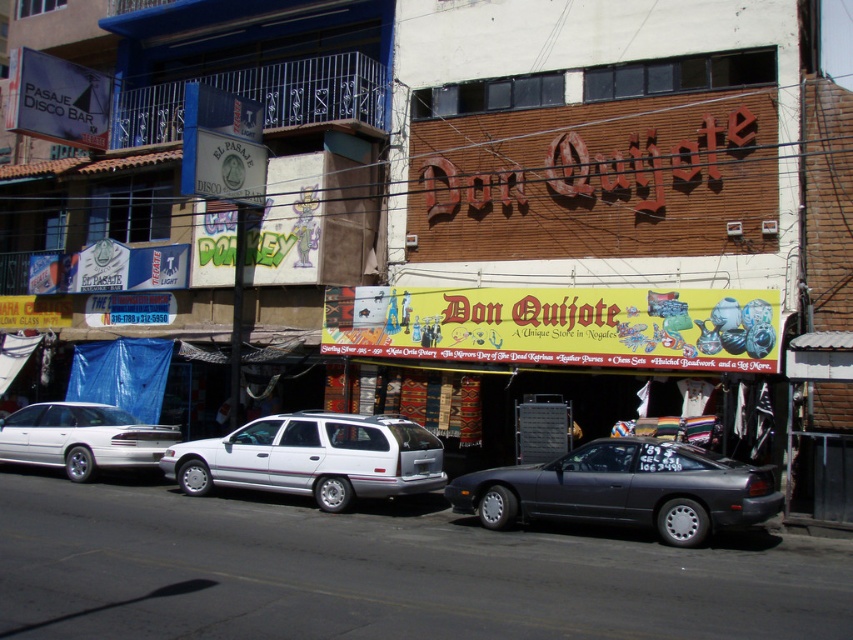
Question: Can you confirm if metallic gray car at center is thinner than white metallic station wagon at center?

Choices:
 (A) no
 (B) yes

Answer: (B)

Question: Can you confirm if metallic gray car at center is positioned to the right of white matte station wagon at left?

Choices:
 (A) no
 (B) yes

Answer: (B)

Question: Among these objects, which one is farthest from the camera?

Choices:
 (A) metallic gray car at center
 (B) white matte station wagon at left
 (C) white metallic station wagon at center

Answer: (B)

Question: Among these objects, which one is farthest from the camera?

Choices:
 (A) white metallic station wagon at center
 (B) white matte station wagon at left
 (C) metallic gray car at center

Answer: (B)

Question: Which of the following is the closest to the observer?

Choices:
 (A) tap(12, 452)
 (B) tap(252, 445)

Answer: (B)

Question: Does white metallic station wagon at center have a smaller size compared to white matte station wagon at left?

Choices:
 (A) yes
 (B) no

Answer: (B)